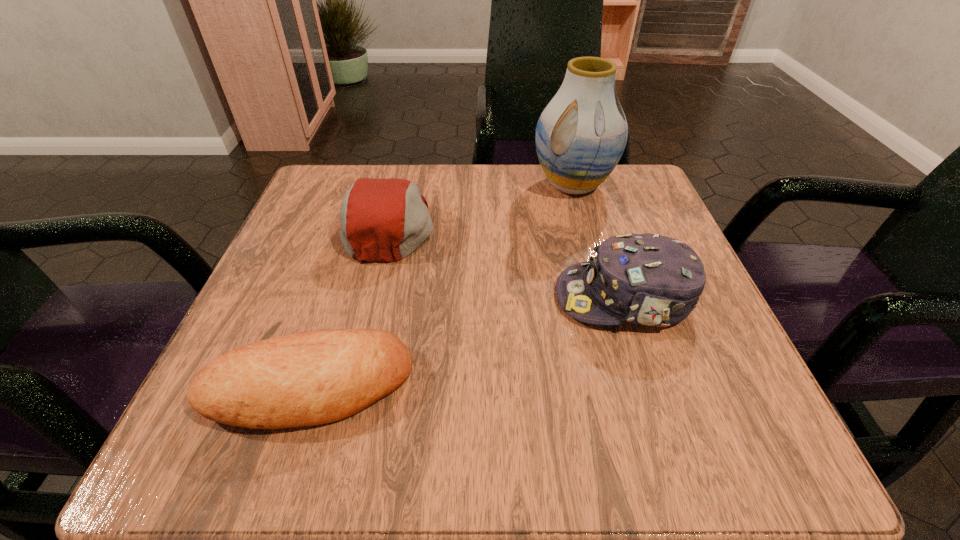
Find the location of a particular element. vacant space situated 0.290m on the back of the nearest object is located at coordinates (361, 225).

Identify the location of vase that is at the far edge. (581, 134).

Locate an element on the screen. cap that is at the far edge is located at coordinates (385, 220).

This screenshot has height=540, width=960. Identify the location of object that is at the near edge. (309, 378).

The width and height of the screenshot is (960, 540). In order to click on cap located at the left edge in this screenshot , I will do pos(385,220).

You are a GUI agent. You are given a task and a screenshot of the screen. Output one action in this format:
    pyautogui.click(x=<x>, y=<y>)
    Task: Click on the bread positioned at the left edge
    The height and width of the screenshot is (540, 960).
    Given the screenshot: What is the action you would take?
    pyautogui.click(x=309, y=378)

Locate an element on the screen. Image resolution: width=960 pixels, height=540 pixels. vase present at the right edge is located at coordinates (581, 134).

Locate an element on the screen. headwear that is at the right edge is located at coordinates (647, 279).

Locate an element on the screen. This screenshot has height=540, width=960. object that is positioned at the far left corner is located at coordinates (385, 220).

Locate an element on the screen. The image size is (960, 540). object that is at the near left corner is located at coordinates click(309, 378).